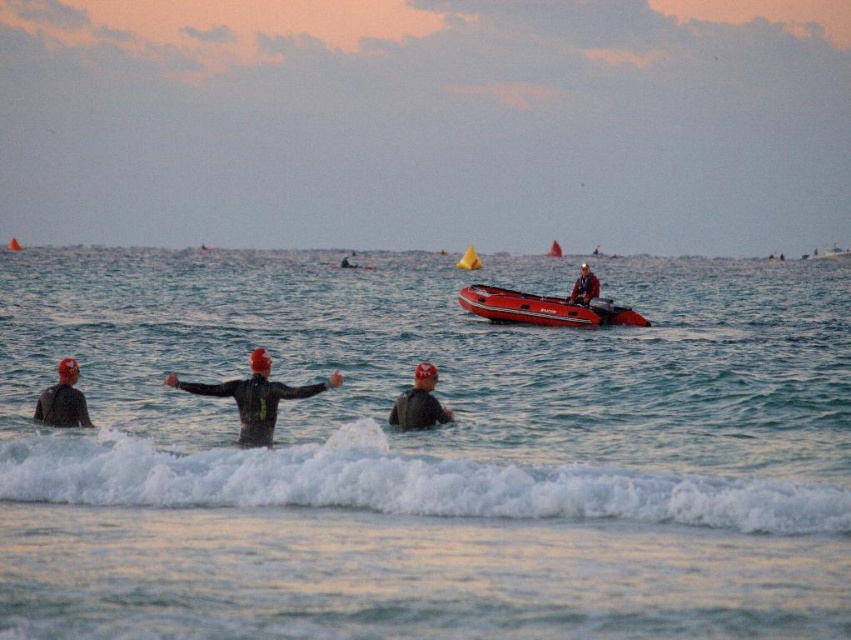
You are a photographer on the beach and want to take a photo of the black wetsuit surfer at center and the matte black wetsuit at center. Which one appears closer to you based on their size?

The black wetsuit surfer at center appears closer because it is smaller than the matte black wetsuit at center, which is further away.

You are a photographer trying to capture the scene of the black wetsuit surfer at center and the matte black wetsuit at center. If you want to frame both subjects in a single shot without zooming, which subject should you position closer to the camera to ensure both fit within the frame?

Since the black wetsuit surfer at center is narrower than the matte black wetsuit at center, positioning the wider matte black wetsuit at center closer to the camera would allow both subjects to fit within the frame more effectively.

You are standing on the beach and see the white foamy wave at lower center approaching. If you can run at 10 feet per second, will you have enough time to reach the safety of the rocky cliff 100 feet behind you before the wave reaches you?

The white foamy wave at lower center is 58.49 feet away from the viewer. To reach the safety of the rocky cliff 100 feet behind, you would need to run 100 feet. The time needed to reach the cliff is 10 seconds. The time the wave takes to reach you is 5.849 seconds. Since 5.849 seconds is less than 10 seconds, you would not have enough time to reach the cliff before the wave arrives.